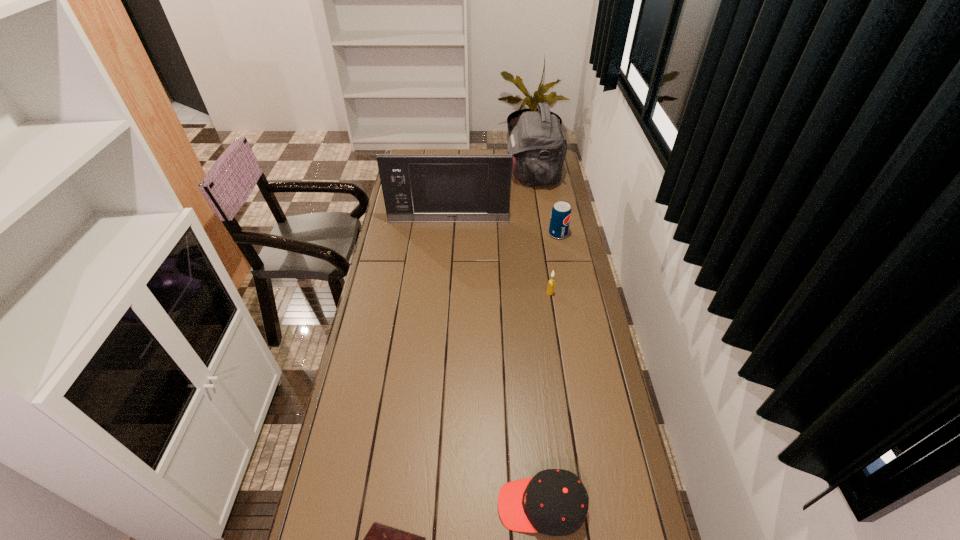
I want to click on free space between the fifth tallest object and the microwave oven, so click(x=495, y=363).

Locate an element on the screen. This screenshot has width=960, height=540. vacant space that's between the fifth nearest object and the fifth tallest object is located at coordinates (495, 363).

This screenshot has height=540, width=960. What are the coordinates of `free space between the fifth nearest object and the third tallest object` in the screenshot? It's located at (503, 228).

Select which object appears as the closest to the cap. Please provide its 2D coordinates. Your answer should be formatted as a tuple, i.e. [(x, y)], where the tuple contains the x and y coordinates of a point satisfying the conditions above.

[(381, 539)]

Identify the location of object that stands as the second closest to the second farthest object. (539, 146).

This screenshot has width=960, height=540. Find the location of `vacant space that satisfies the following two spatial constraints: 1. on the front panel of the candle; 2. on the right side of the microwave oven`. vacant space that satisfies the following two spatial constraints: 1. on the front panel of the candle; 2. on the right side of the microwave oven is located at coordinates (443, 293).

Locate an element on the screen. The height and width of the screenshot is (540, 960). free space that satisfies the following two spatial constraints: 1. on the front panel of the fifth nearest object; 2. on the right side of the third farthest object is located at coordinates (447, 234).

At what (x,y) coordinates should I click in order to perform the action: click on vacant position in the image that satisfies the following two spatial constraints: 1. on the front panel of the pop; 2. on the left side of the second farthest object. Please return your answer as a coordinate pair (x, y). Image resolution: width=960 pixels, height=540 pixels. Looking at the image, I should click on (447, 234).

This screenshot has width=960, height=540. What are the coordinates of `vacant region that satisfies the following two spatial constraints: 1. on the open flap of the fourth nearest object; 2. on the right side of the shoulder bag` in the screenshot? It's located at (542, 234).